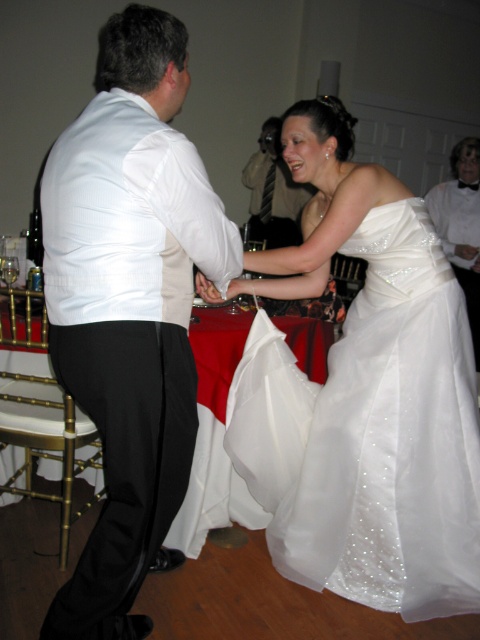
You are a photographer standing at the camera position. The bride is wearing a satin white dress at center. You need to capture a full body shot of the bride. The minimum focusing distance of your camera is 1.8 meters. Can you take the photo without moving closer?

The distance between the satin white dress at center and the camera is 1.72 meters, which is less than the camera minimum focusing distance of 1.8 meters. Therefore, you cannot take the photo without moving closer.

What are the coordinates of the satin white dress at center?

The satin white dress at center is located at point (376, 392).